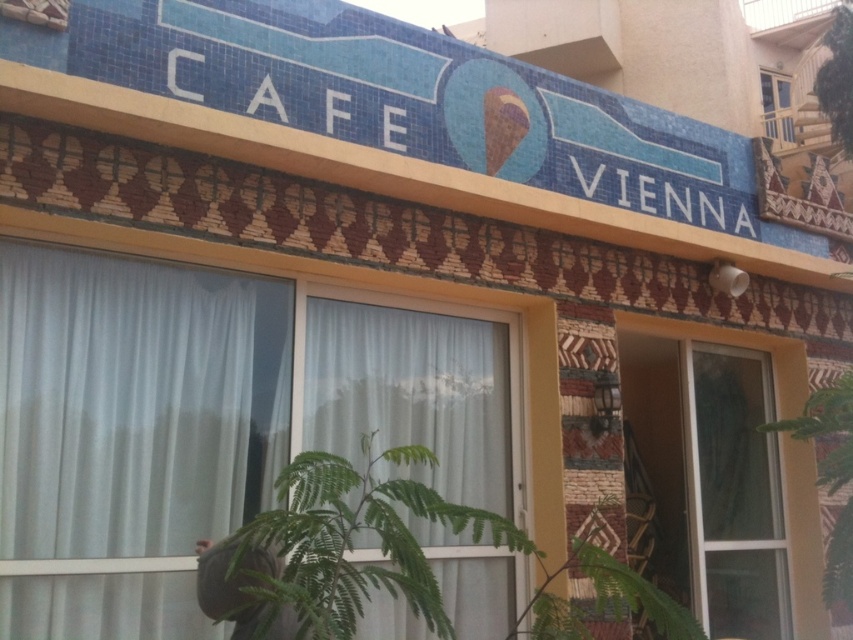
Question: Which point is farther from the camera taking this photo?

Choices:
 (A) (790, 141)
 (B) (152, 340)
 (C) (668, 362)

Answer: (A)

Question: Does transparent glass door at center appear under clear glass window at upper right?

Choices:
 (A) yes
 (B) no

Answer: (A)

Question: From the image, what is the correct spatial relationship of dark gray fabric cap at lower center in relation to clear glass window at upper right?

Choices:
 (A) right
 (B) left

Answer: (B)

Question: Which point appears closest to the camera in this image?

Choices:
 (A) (138, 579)
 (B) (788, 451)
 (C) (780, 118)
 (D) (254, 563)

Answer: (D)

Question: Does dark gray fabric cap at lower center appear over clear glass window at upper right?

Choices:
 (A) yes
 (B) no

Answer: (B)

Question: Based on their relative distances, which object is nearer to the transparent glass door at center?

Choices:
 (A) dark gray fabric cap at lower center
 (B) clear glass window at upper right
 (C) white sheer curtain at lower left

Answer: (B)